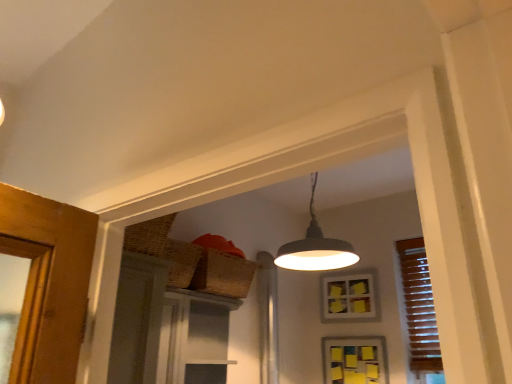
Question: Which direction should I rotate to look at yellow sticky notes at center, acting as the first window starting from the top, — up or down?

Choices:
 (A) up
 (B) down

Answer: (B)

Question: Considering the relative positions of matte gray lampshade at upper center and yellow sticky notes at center, acting as the first window starting from the top, in the image provided, is matte gray lampshade at upper center in front of yellow sticky notes at center, acting as the first window starting from the top,?

Choices:
 (A) no
 (B) yes

Answer: (B)

Question: Is matte gray lampshade at upper center surrounding yellow sticky notes at center, which is the 2th window in bottom-to-top order?

Choices:
 (A) yes
 (B) no

Answer: (B)

Question: Is matte gray lampshade at upper center shorter than yellow sticky notes at center, acting as the first window starting from the top?

Choices:
 (A) yes
 (B) no

Answer: (B)

Question: From a real-world perspective, is matte gray lampshade at upper center located higher than yellow sticky notes at center, which is the 2th window in bottom-to-top order?

Choices:
 (A) yes
 (B) no

Answer: (A)

Question: Is matte gray lampshade at upper center touching yellow sticky notes at center, acting as the first window starting from the top?

Choices:
 (A) no
 (B) yes

Answer: (A)

Question: Is matte gray lampshade at upper center outside yellow sticky notes at center, acting as the first window starting from the top?

Choices:
 (A) no
 (B) yes

Answer: (B)

Question: Considering the relative sizes of yellow paper at upper center, which is the second window in top-to-bottom order, and yellow sticky notes at center, acting as the first window starting from the top, in the image provided, is yellow paper at upper center, which is the second window in top-to-bottom order, bigger than yellow sticky notes at center, acting as the first window starting from the top,?

Choices:
 (A) no
 (B) yes

Answer: (A)

Question: Is yellow paper at upper center, which is the second window in top-to-bottom order, not close to yellow sticky notes at center, acting as the first window starting from the top?

Choices:
 (A) no
 (B) yes

Answer: (A)

Question: Is yellow paper at upper center, which is the second window in top-to-bottom order, next to yellow sticky notes at center, acting as the first window starting from the top?

Choices:
 (A) no
 (B) yes

Answer: (A)

Question: Is yellow paper at upper center, which is the second window in top-to-bottom order, further to the viewer compared to yellow sticky notes at center, which is the 2th window in bottom-to-top order?

Choices:
 (A) yes
 (B) no

Answer: (B)

Question: Considering the relative sizes of yellow paper at upper center, the 1th window in the bottom-to-top sequence, and yellow sticky notes at center, which is the 2th window in bottom-to-top order, in the image provided, is yellow paper at upper center, the 1th window in the bottom-to-top sequence, wider than yellow sticky notes at center, which is the 2th window in bottom-to-top order,?

Choices:
 (A) yes
 (B) no

Answer: (B)

Question: From the image's perspective, would you say yellow paper at upper center, which is the second window in top-to-bottom order, is shown under yellow sticky notes at center, acting as the first window starting from the top?

Choices:
 (A) no
 (B) yes

Answer: (B)

Question: Is matte gray lampshade at upper center positioned beyond the bounds of matte gray screen door at center?

Choices:
 (A) yes
 (B) no

Answer: (A)